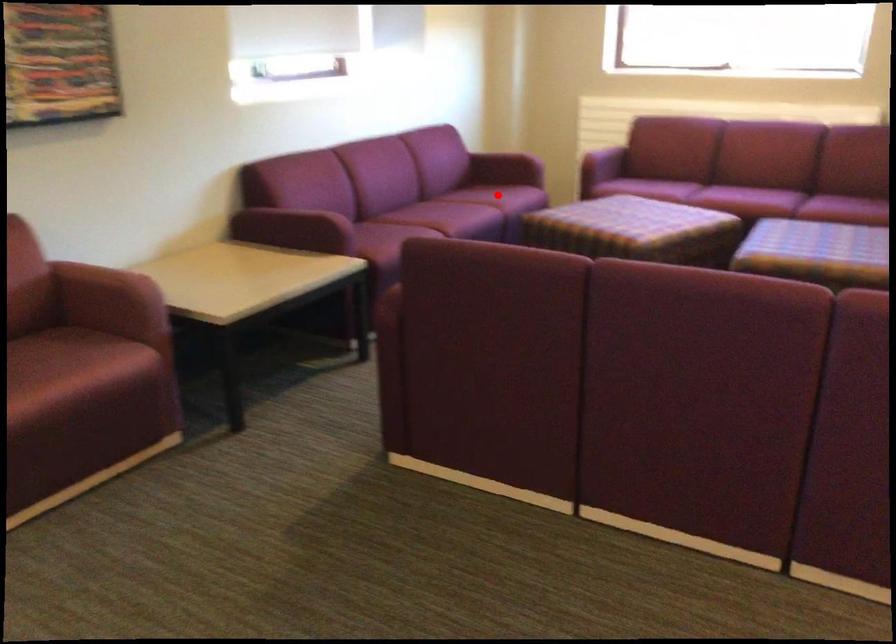
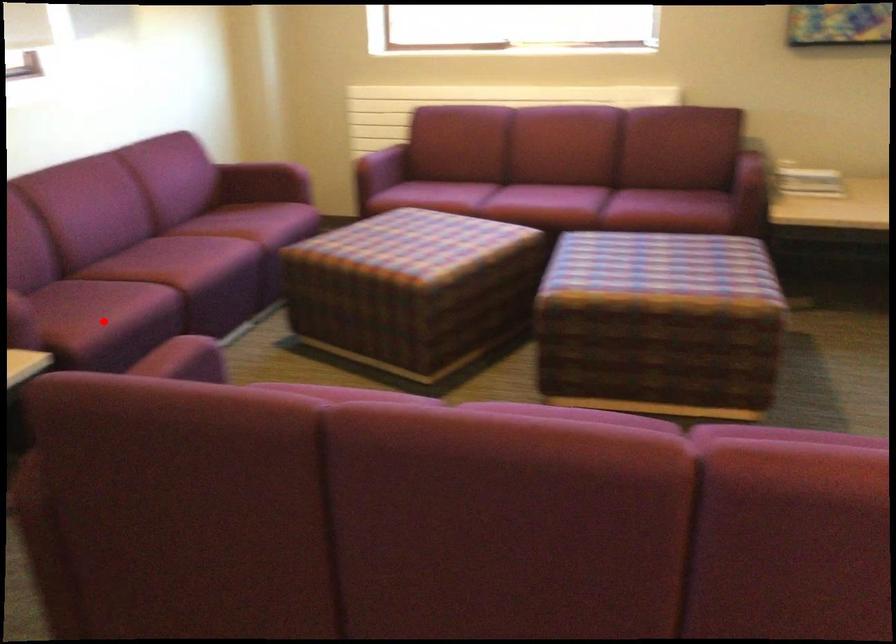
I am providing you with two images of the same scene from different viewpoints. A red point is marked on the first image and another point is marked on the second image. Does the point marked in image1 correspond to the same location as the one in image2?

No